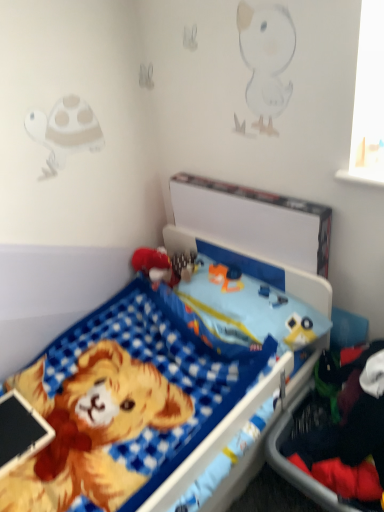
Question: From the image's perspective, is red plush toy at center located above or below blue checkered bed at center?

Choices:
 (A) below
 (B) above

Answer: (B)

Question: Which is correct: red plush toy at center is inside blue checkered bed at center, or outside of it?

Choices:
 (A) outside
 (B) inside

Answer: (B)

Question: Considering the real-world distances, which object is farthest from the red plush toy at center?

Choices:
 (A) dark blue fabric at lower right
 (B) blue checkered bed at center

Answer: (A)

Question: Based on their relative distances, which object is nearer to the red plush toy at center?

Choices:
 (A) dark blue fabric at lower right
 (B) blue checkered bed at center

Answer: (B)